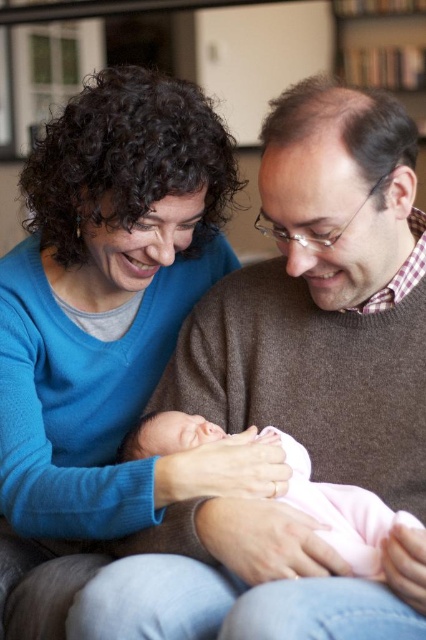
Question: Observing the image, what is the correct spatial positioning of brown sweater at center in reference to pink soft fabric newborn at center?

Choices:
 (A) below
 (B) above

Answer: (B)

Question: Is brown sweater at center thinner than blue sweater at upper left?

Choices:
 (A) yes
 (B) no

Answer: (B)

Question: Which is farther from the blue sweater at upper left?

Choices:
 (A) wooden bookshelf at upper center
 (B) brown sweater at center

Answer: (A)

Question: Which point appears closest to the camera in this image?

Choices:
 (A) (405, 84)
 (B) (109, 211)
 (C) (339, 480)
 (D) (290, 467)

Answer: (D)

Question: Does pink soft fabric newborn at center have a larger size compared to wooden bookshelf at upper center?

Choices:
 (A) no
 (B) yes

Answer: (A)

Question: Among these points, which one is farthest from the camera?

Choices:
 (A) (313, 499)
 (B) (143, 188)
 (C) (370, 36)

Answer: (C)